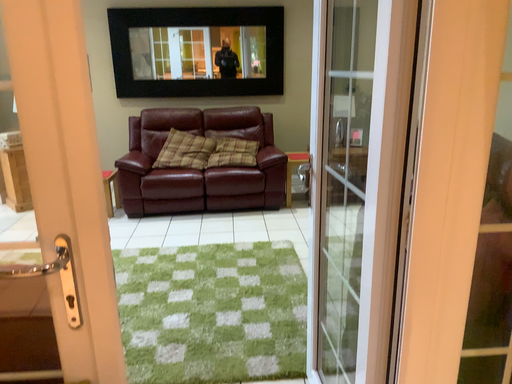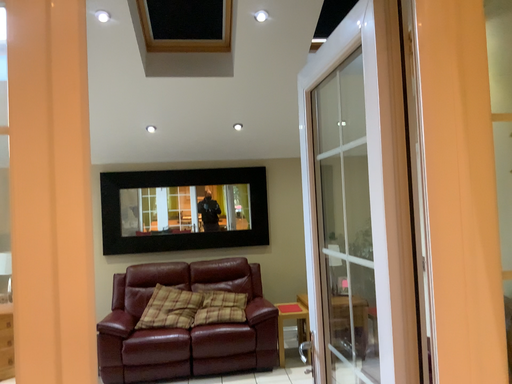
Question: How did the camera likely rotate when shooting the video?

Choices:
 (A) rotated upward
 (B) rotated downward

Answer: (A)